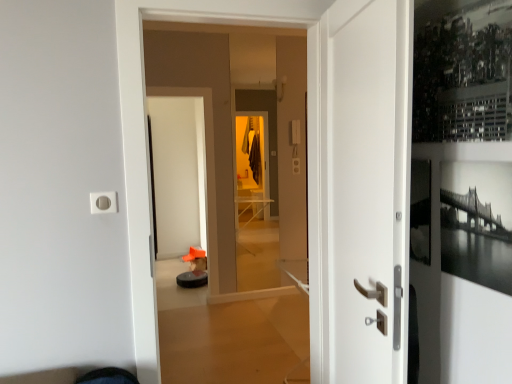
Question: Is black glossy screen door at center located within white matte door at center, positioned as the second door in left-to-right order?

Choices:
 (A) yes
 (B) no

Answer: (B)

Question: Is black glossy screen door at center at the back of white matte door at center, positioned as the second door in left-to-right order?

Choices:
 (A) yes
 (B) no

Answer: (B)

Question: Is the surface of white matte door at center, positioned as the second door in left-to-right order, in direct contact with black glossy screen door at center?

Choices:
 (A) yes
 (B) no

Answer: (B)

Question: Is white matte door at center, positioned as the second door in left-to-right order, bigger than black glossy screen door at center?

Choices:
 (A) yes
 (B) no

Answer: (B)

Question: Is white matte door at center, positioned as the second door in left-to-right order, completely or partially outside of black glossy screen door at center?

Choices:
 (A) no
 (B) yes

Answer: (B)

Question: Considering the positions of black glossy screen door at center and white matte door at center, which appears as the 1th door when viewed from the right, in the image, is black glossy screen door at center taller or shorter than white matte door at center, which appears as the 1th door when viewed from the right,?

Choices:
 (A) short
 (B) tall

Answer: (B)

Question: In terms of width, does black glossy screen door at center look wider or thinner when compared to white matte door at center, positioned as the second door in left-to-right order?

Choices:
 (A) thin
 (B) wide

Answer: (B)

Question: Is point (177, 145) positioned closer to the camera than point (317, 291)?

Choices:
 (A) farther
 (B) closer

Answer: (A)

Question: Is black glossy screen door at center spatially inside white matte door at center, which appears as the 1th door when viewed from the right, or outside of it?

Choices:
 (A) outside
 (B) inside

Answer: (A)

Question: Is point [184, 279] positioned closer to the camera than point [117, 19]?

Choices:
 (A) closer
 (B) farther

Answer: (B)

Question: From the image's perspective, is black plastic robot vacuum cleaner at lower center above or below white glossy door at center, the second door positioned from the right?

Choices:
 (A) above
 (B) below

Answer: (B)

Question: In terms of width, does black plastic robot vacuum cleaner at lower center look wider or thinner when compared to white glossy door at center, which is the 1th door from left to right?

Choices:
 (A) wide
 (B) thin

Answer: (A)

Question: From a real-world perspective, is black plastic robot vacuum cleaner at lower center above or below white glossy door at center, which is the 1th door from left to right?

Choices:
 (A) above
 (B) below

Answer: (B)

Question: Considering the positions of white glossy door at center, the second door positioned from the right, and white matte door at center, which appears as the 1th door when viewed from the right, in the image, is white glossy door at center, the second door positioned from the right, taller or shorter than white matte door at center, which appears as the 1th door when viewed from the right,?

Choices:
 (A) tall
 (B) short

Answer: (A)

Question: In terms of width, does white glossy door at center, the second door positioned from the right, look wider or thinner when compared to white matte door at center, which appears as the 1th door when viewed from the right?

Choices:
 (A) wide
 (B) thin

Answer: (A)